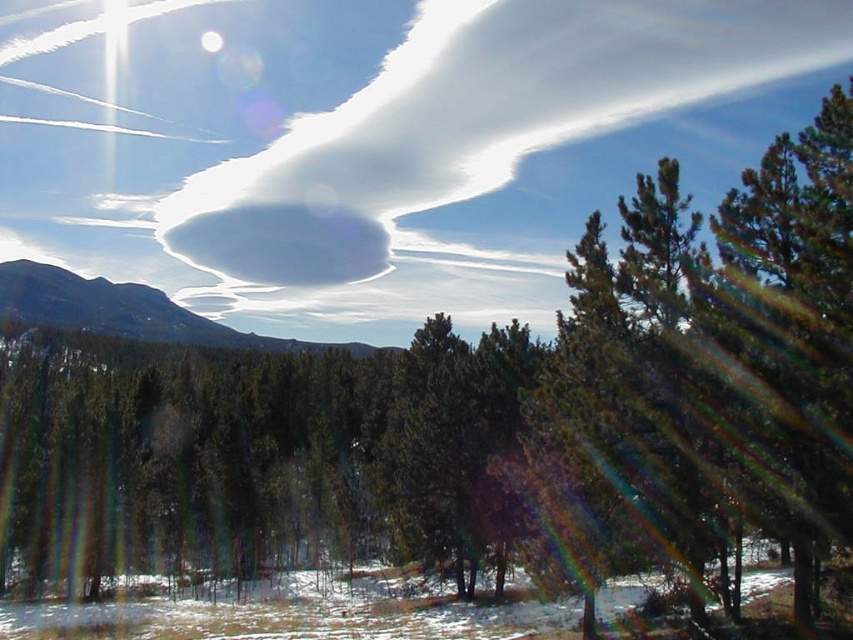
Question: Which of the following is the closest to the observer?

Choices:
 (A) smooth gray rock at upper left
 (B) white fluffy cloud at upper center

Answer: (A)

Question: Which point appears closest to the camera in this image?

Choices:
 (A) (65, 273)
 (B) (378, 214)

Answer: (B)

Question: Can you confirm if white fluffy cloud at upper center is positioned to the left of smooth gray rock at upper left?

Choices:
 (A) yes
 (B) no

Answer: (B)

Question: Where is white fluffy cloud at upper center located in relation to smooth gray rock at upper left in the image?

Choices:
 (A) right
 (B) left

Answer: (A)

Question: Does white fluffy cloud at upper center have a smaller size compared to smooth gray rock at upper left?

Choices:
 (A) no
 (B) yes

Answer: (A)